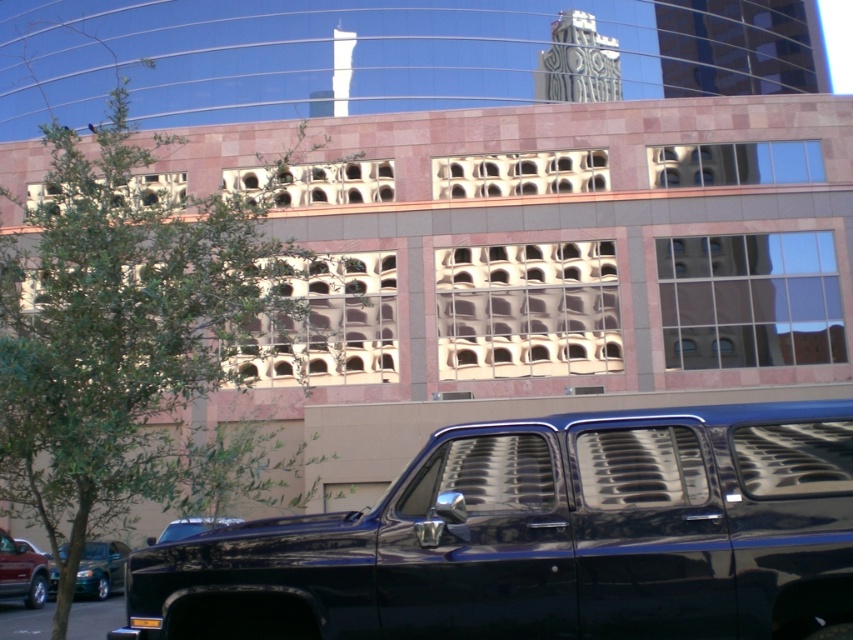
Can you confirm if green leafy tree at upper left is taller than metallic green sedan at lower left?

Correct, green leafy tree at upper left is much taller as metallic green sedan at lower left.

Based on the photo, does green leafy tree at upper left have a larger size compared to metallic green sedan at lower left?

Correct, green leafy tree at upper left is larger in size than metallic green sedan at lower left.

Who is more forward, [289,276] or [123,573]?

Point [289,276] is more forward.

Where is `green leafy tree at upper left`? The width and height of the screenshot is (853, 640). green leafy tree at upper left is located at coordinates (135, 340).

Between glossy black truck at lower center and metallic green sedan at lower left, which one appears on the right side from the viewer's perspective?

Positioned to the right is glossy black truck at lower center.

Does glossy black truck at lower center have a smaller size compared to metallic green sedan at lower left?

Indeed, glossy black truck at lower center has a smaller size compared to metallic green sedan at lower left.

Which is in front, point (706, 422) or point (109, 589)?

Point (706, 422) is more forward.

I want to click on glossy black truck at lower center, so click(546, 538).

Who is shorter, green leafy tree at upper left or shiny black truck at lower center?

With less height is shiny black truck at lower center.

Is point (177, 282) in front of point (219, 522)?

Yes, point (177, 282) is closer to viewer.

At what (x,y) coordinates should I click in order to perform the action: click on green leafy tree at upper left. Please return your answer as a coordinate pair (x, y). Looking at the image, I should click on (135, 340).